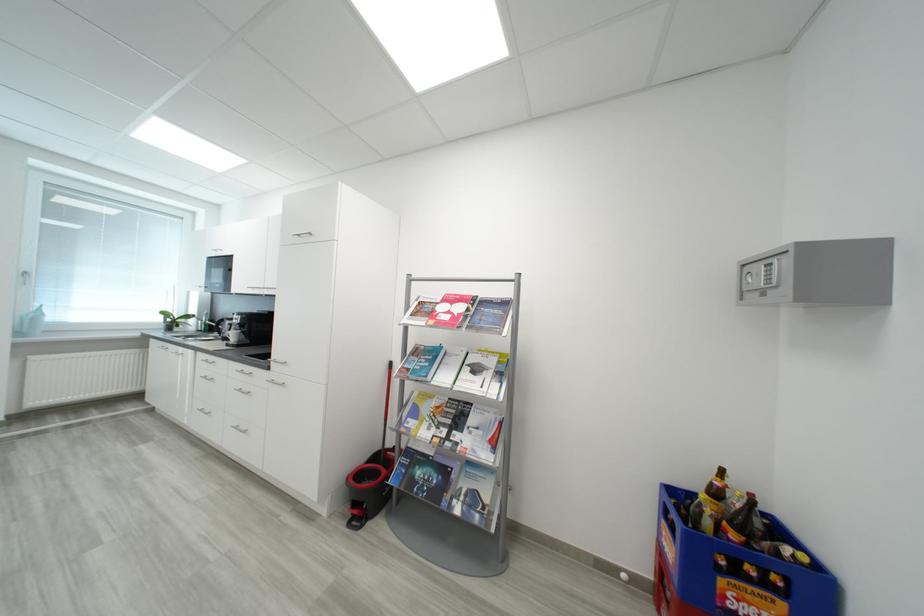
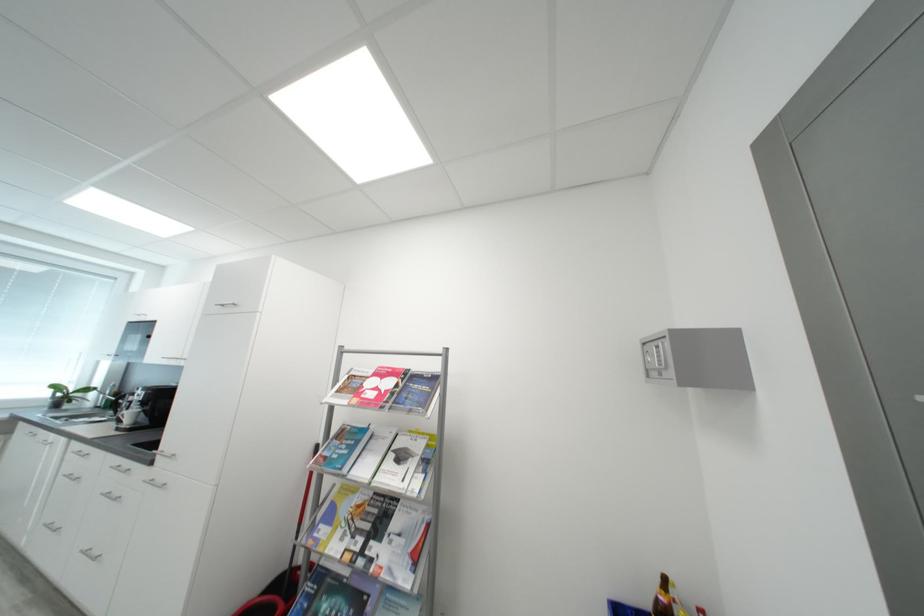
Find the pixel in the second image that matches the point at 456,317 in the first image.

(383, 395)